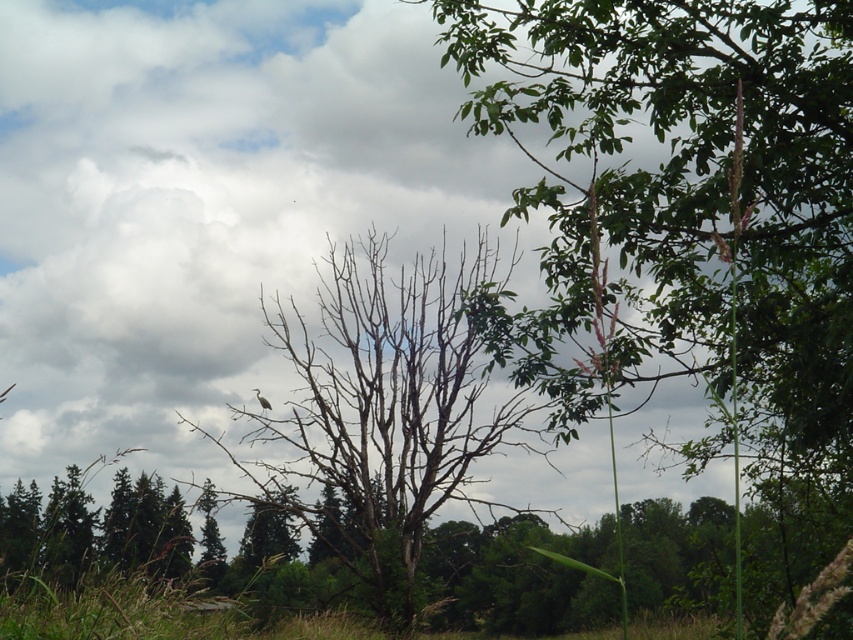
Question: Which point is closer to the camera?

Choices:
 (A) (811, 422)
 (B) (358, 244)

Answer: (A)

Question: Can you confirm if green leafy tree at upper right is positioned below bare branches at center?

Choices:
 (A) no
 (B) yes

Answer: (A)

Question: Does green leafy tree at upper right have a greater width compared to bare branches at center?

Choices:
 (A) no
 (B) yes

Answer: (A)

Question: Can you confirm if green leafy tree at upper right is positioned above bare branches at center?

Choices:
 (A) no
 (B) yes

Answer: (B)